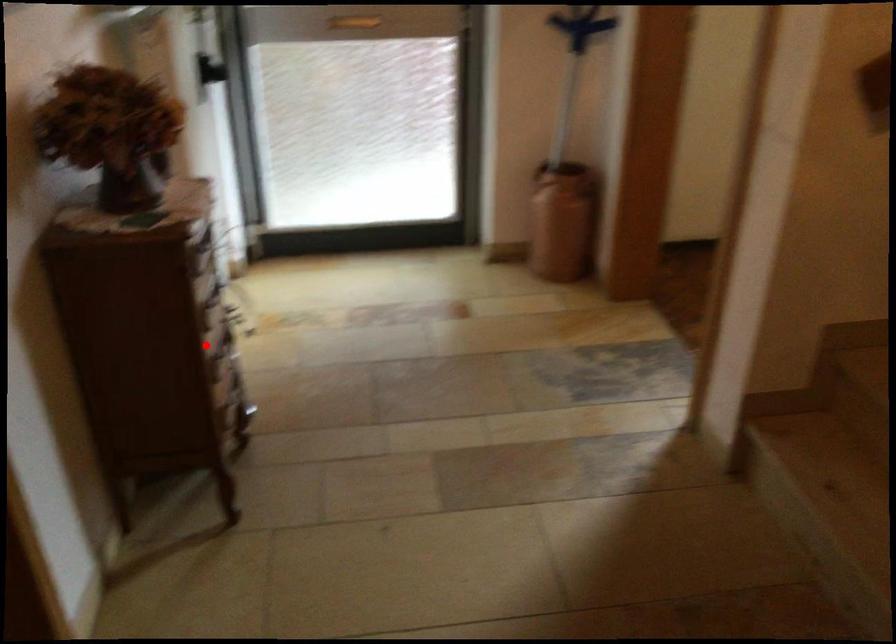
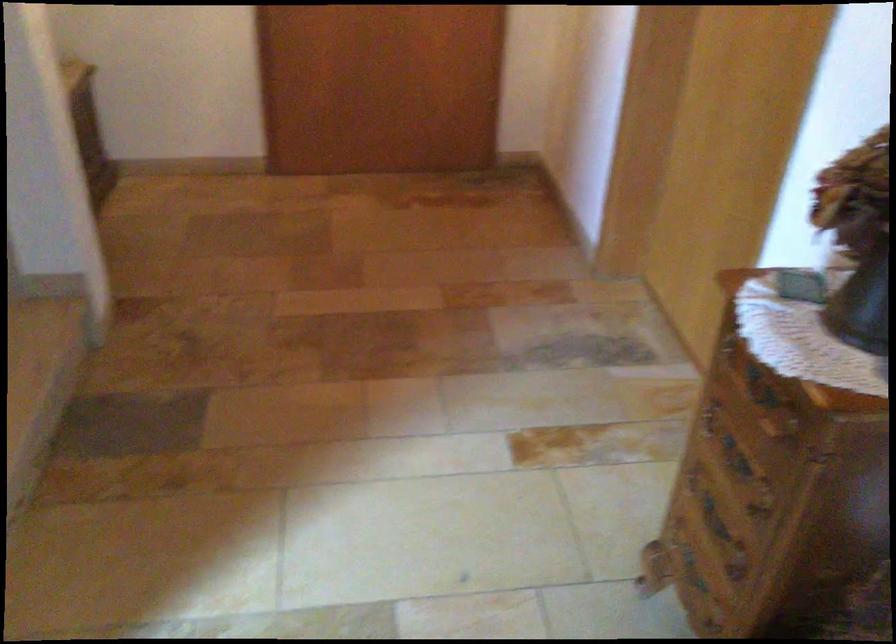
Find the pixel in the second image that matches the highlighted location in the first image.

(735, 457)